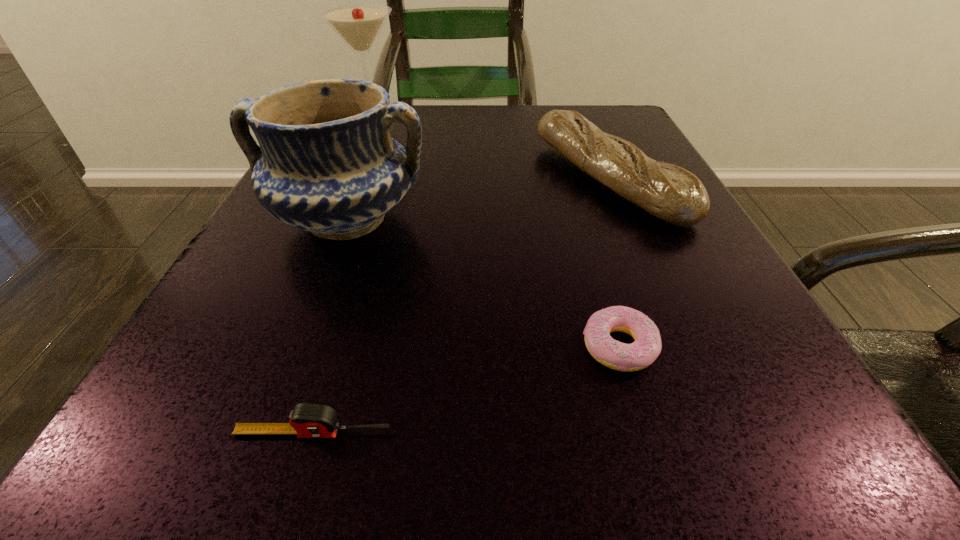
Find the location of a particular element. The width and height of the screenshot is (960, 540). object situated at the far left corner is located at coordinates (359, 24).

This screenshot has height=540, width=960. What are the coordinates of `object that is at the near left corner` in the screenshot? It's located at (307, 420).

Find the location of a particular element. This screenshot has width=960, height=540. object present at the far right corner is located at coordinates (674, 195).

At what (x,y) coordinates should I click in order to perform the action: click on free space at the far edge of the desktop. Please return your answer as a coordinate pair (x, y). Looking at the image, I should click on (430, 114).

I want to click on vacant area at the near edge of the desktop, so click(370, 439).

In the image, there is a desktop. Where is `blank space at the left edge`? blank space at the left edge is located at coordinates (222, 302).

In the image, there is a desktop. Where is `vacant region at the right edge`? vacant region at the right edge is located at coordinates (754, 349).

Identify the location of vacant region at the far left corner of the desktop. This screenshot has width=960, height=540. (393, 123).

Where is `vacant space at the near left corner of the desktop`? The height and width of the screenshot is (540, 960). vacant space at the near left corner of the desktop is located at coordinates (195, 428).

I want to click on free space at the far right corner, so click(x=632, y=116).